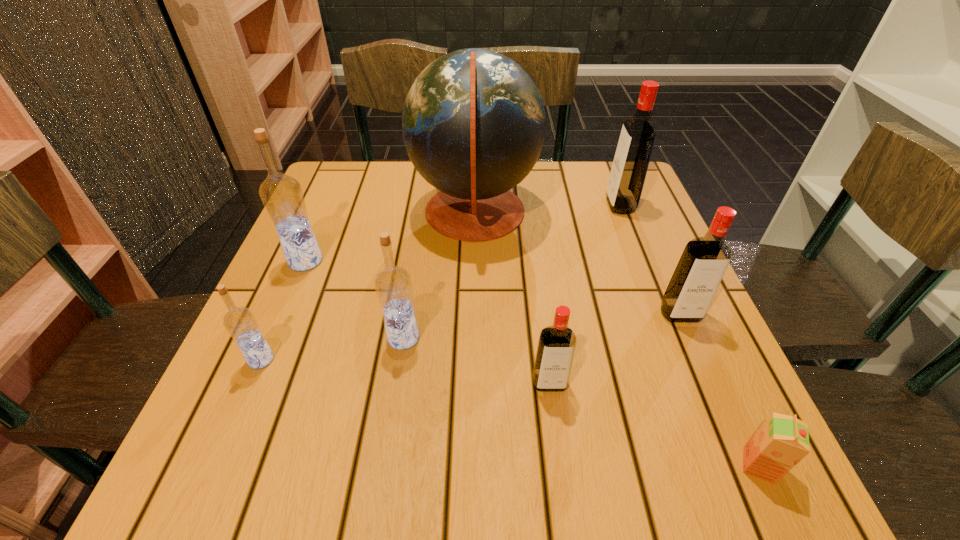
You are a GUI agent. You are given a task and a screenshot of the screen. Output one action in this format:
    pyautogui.click(x=<x>, y=<y>)
    Task: Click on the tallest object
    This screenshot has height=540, width=960.
    Given the screenshot: What is the action you would take?
    pyautogui.click(x=473, y=123)

The image size is (960, 540). I want to click on the biggest blue vodka, so click(282, 196).

Image resolution: width=960 pixels, height=540 pixels. In order to click on the farthest blue vodka in this screenshot , I will do `click(282, 196)`.

Where is `the farthest vodka`? Image resolution: width=960 pixels, height=540 pixels. the farthest vodka is located at coordinates (630, 164).

Image resolution: width=960 pixels, height=540 pixels. What are the coordinates of `the biggest red vodka` in the screenshot? It's located at (630, 164).

This screenshot has height=540, width=960. In order to click on the rightmost blue vodka in this screenshot , I will do `click(393, 284)`.

The height and width of the screenshot is (540, 960). In order to click on the fourth vodka from right to left in this screenshot , I will do click(393, 284).

Find the location of a particular element. This screenshot has width=960, height=540. the second farthest red vodka is located at coordinates (703, 263).

Where is `the second smallest red vodka`? the second smallest red vodka is located at coordinates (703, 263).

The image size is (960, 540). What are the coordinates of `the seventh farthest object` in the screenshot? It's located at (556, 346).